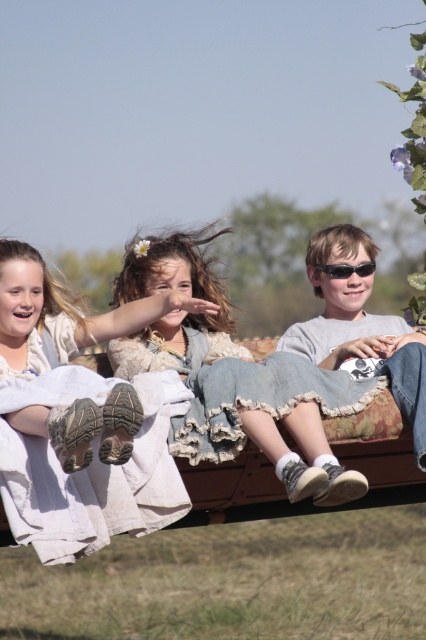
Who is positioned more to the left, denim jeans at center or denim jeans at right?

denim jeans at center is more to the left.

Where is `denim jeans at center`? The height and width of the screenshot is (640, 426). denim jeans at center is located at coordinates (63, 312).

Where is `denim skirt at center`? Image resolution: width=426 pixels, height=640 pixels. denim skirt at center is located at coordinates (232, 376).

In the scene shown: Which is above, denim skirt at center or denim jeans at right?

denim skirt at center is above.

Who is more forward, (271, 362) or (340, 356)?

Point (271, 362) is in front.

Locate an element on the screen. denim skirt at center is located at coordinates (232, 376).

Is point (157, 342) in front of point (0, 323)?

No, (157, 342) is behind (0, 323).

Between point (169, 275) and point (40, 349), which one is positioned behind?

The point (169, 275) is more distant.

Where is `denim skirt at center`? denim skirt at center is located at coordinates (232, 376).

Where is `denim skirt at center`? denim skirt at center is located at coordinates (232, 376).